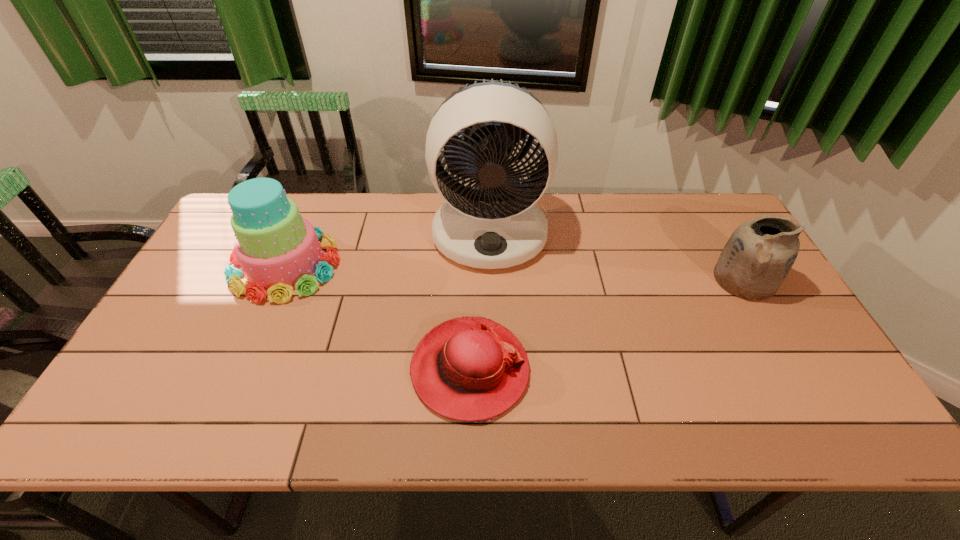
You are a GUI agent. You are given a task and a screenshot of the screen. Output one action in this format:
    pyautogui.click(x=<x>, y=<y>)
    Task: Click on the free location located at the front of the hat with a bow
    The height and width of the screenshot is (540, 960).
    Given the screenshot: What is the action you would take?
    pyautogui.click(x=579, y=369)

Find the location of a particular element. fan located in the far edge section of the desktop is located at coordinates (497, 224).

The image size is (960, 540). Identify the location of cake located at the far edge. (279, 251).

Locate an element on the screen. object at the near edge is located at coordinates (472, 369).

Identify the location of object that is positioned at the left edge. The width and height of the screenshot is (960, 540). (279, 251).

You are a GUI agent. You are given a task and a screenshot of the screen. Output one action in this format:
    pyautogui.click(x=<x>, y=<y>)
    Task: Click on the object that is at the right edge
    The height and width of the screenshot is (540, 960).
    Given the screenshot: What is the action you would take?
    pyautogui.click(x=758, y=256)

The height and width of the screenshot is (540, 960). What are the coordinates of `object positioned at the far left corner` in the screenshot? It's located at (279, 251).

The width and height of the screenshot is (960, 540). In order to click on free space at the far edge of the desktop in this screenshot , I will do `click(428, 214)`.

At what (x,y) coordinates should I click in order to perform the action: click on vacant space at the near edge of the desktop. Please return your answer as a coordinate pair (x, y). The image size is (960, 540). Looking at the image, I should click on (493, 424).

The height and width of the screenshot is (540, 960). In the image, there is a desktop. Identify the location of free space at the left edge. (171, 378).